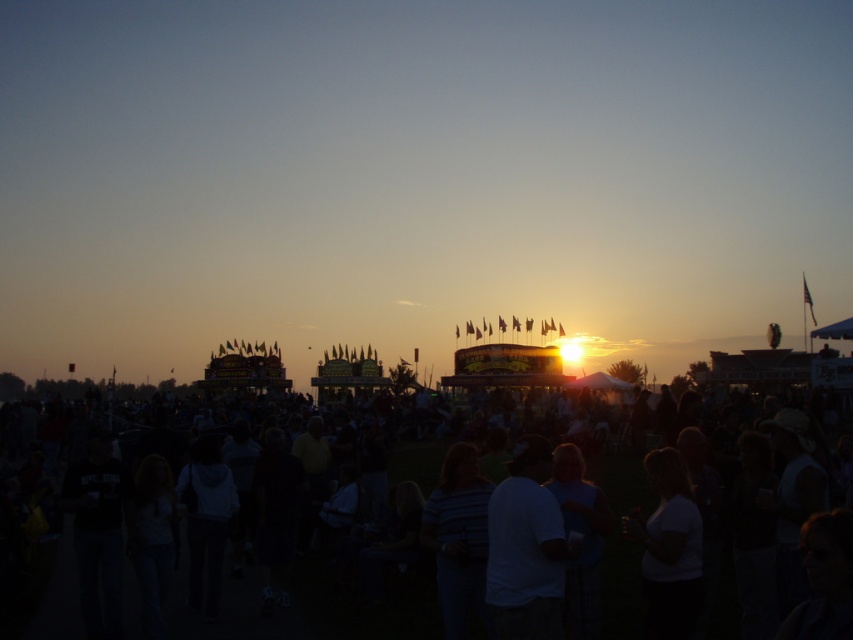
You are a photographer trying to capture a photo of the white matte shirt at center without the black matte crowd at center blocking it. Is there a possibility that the crowd might block the shirt in your shot?

The black matte crowd at center might be wider than the white matte shirt at center, so there is a possibility that the crowd could block the shirt in your photo.

You are an event planner trying to ensure safety at the fairground. You notice the black matte crowd at center and the white matte shirt at center. Which object is covering the other?

The black matte crowd at center is positioned over white matte shirt at center, so the crowd is covering the shirt.